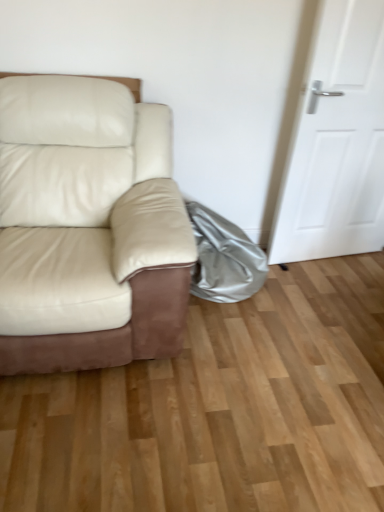
The image size is (384, 512). Find the location of `vacant area that lies to the right of matte cream leather couch at left`. vacant area that lies to the right of matte cream leather couch at left is located at coordinates (282, 358).